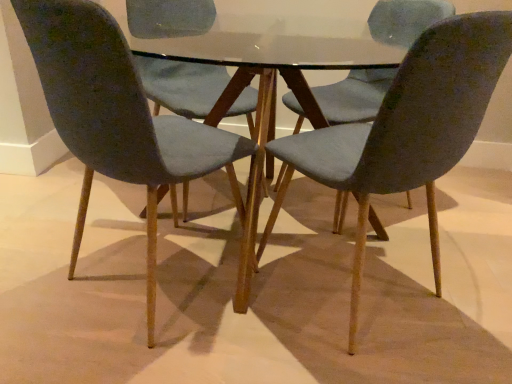
The image size is (512, 384). What do you see at coordinates (197, 88) in the screenshot?
I see `velvet blue chair at center, which appears as the second chair when viewed from the left` at bounding box center [197, 88].

In order to face matte blue chair at center, placed as the third chair when sorted from left to right, should I rotate leftwards or rightwards?

Turn right approximately 15.133 degrees to face it.

The width and height of the screenshot is (512, 384). Find the location of `velvet blue chair at center, the 2th chair from the right`. velvet blue chair at center, the 2th chair from the right is located at coordinates coord(197,88).

Which of these two, glass table at center or matte blue chair at center, which is the first chair from right to left, is bigger?

glass table at center.

Where is `chair that is the 2nd one when counting downward from the glass table at center (from the image's perspective)`? Image resolution: width=512 pixels, height=384 pixels. chair that is the 2nd one when counting downward from the glass table at center (from the image's perspective) is located at coordinates (406, 130).

From the image's perspective, between glass table at center and matte blue chair at center, which is the first chair from right to left, who is located below?

matte blue chair at center, which is the first chair from right to left, from the image's perspective.

Does glass table at center lie behind matte blue chair at center, placed as the third chair when sorted from left to right?

Yes, it is behind matte blue chair at center, placed as the third chair when sorted from left to right.

Would you say matte blue chair at center, placed as the third chair when sorted from left to right, is to the left or to the right of glass table at center in the picture?

matte blue chair at center, placed as the third chair when sorted from left to right, is to the right of glass table at center.

Is matte blue chair at center, placed as the third chair when sorted from left to right, located outside glass table at center?

No, matte blue chair at center, placed as the third chair when sorted from left to right, is not outside of glass table at center.

From the image's perspective, is matte blue chair at center, placed as the third chair when sorted from left to right, beneath glass table at center?

Correct, matte blue chair at center, placed as the third chair when sorted from left to right, appears lower than glass table at center in the image.

Consider the image. Between matte gray chair at left, which appears as the 3th chair when viewed from the right, and glass table at center, which one has less height?

Standing shorter between the two is glass table at center.

Which object is further away from the camera taking this photo, matte gray chair at left, the first chair viewed from the left, or glass table at center?

glass table at center is further from the camera.

From the image's perspective, is matte gray chair at left, which appears as the 3th chair when viewed from the right, below glass table at center?

Indeed, from the image's perspective, matte gray chair at left, which appears as the 3th chair when viewed from the right, is shown beneath glass table at center.

Could you measure the distance between matte gray chair at left, which appears as the 3th chair when viewed from the right, and glass table at center?

matte gray chair at left, which appears as the 3th chair when viewed from the right, and glass table at center are 19.06 inches apart.

Is matte blue chair at center, placed as the third chair when sorted from left to right, not close to velvet blue chair at center, which appears as the second chair when viewed from the left?

No.

Considering the points (413, 151) and (186, 80), which point is behind, point (413, 151) or point (186, 80)?

Point (186, 80)

Is matte blue chair at center, which is the first chair from right to left, at the right side of velvet blue chair at center, which appears as the second chair when viewed from the left?

Correct, you'll find matte blue chair at center, which is the first chair from right to left, to the right of velvet blue chair at center, which appears as the second chair when viewed from the left.

Between matte blue chair at center, which is the first chair from right to left, and velvet blue chair at center, which appears as the second chair when viewed from the left, which one has less height?

Standing shorter between the two is velvet blue chair at center, which appears as the second chair when viewed from the left.

From a real-world perspective, between glass table at center and velvet blue chair at center, the 2th chair from the right, who is vertically higher?

velvet blue chair at center, the 2th chair from the right, is physically above.

How much distance is there between glass table at center and velvet blue chair at center, which appears as the second chair when viewed from the left?

The distance of glass table at center from velvet blue chair at center, which appears as the second chair when viewed from the left, is 8.11 inches.

In the scene shown: Between glass table at center and velvet blue chair at center, the 2th chair from the right, which one has smaller width?

velvet blue chair at center, the 2th chair from the right.

In the scene shown: Are velvet blue chair at center, which appears as the second chair when viewed from the left, and matte gray chair at left, the first chair viewed from the left, making contact?

No, velvet blue chair at center, which appears as the second chair when viewed from the left, is not in contact with matte gray chair at left, the first chair viewed from the left.

Considering the sizes of velvet blue chair at center, the 2th chair from the right, and matte gray chair at left, the first chair viewed from the left, in the image, is velvet blue chair at center, the 2th chair from the right, wider or thinner than matte gray chair at left, the first chair viewed from the left,?

Clearly, velvet blue chair at center, the 2th chair from the right, has less width compared to matte gray chair at left, the first chair viewed from the left.

Where is `round table that is above the matte gray chair at left, the first chair viewed from the left (from the image's perspective)`? The width and height of the screenshot is (512, 384). round table that is above the matte gray chair at left, the first chair viewed from the left (from the image's perspective) is located at coordinates (289, 52).

Is glass table at center oriented away from matte gray chair at left, which appears as the 3th chair when viewed from the right?

No, glass table at center is not facing the opposite direction of matte gray chair at left, which appears as the 3th chair when viewed from the right.

Does glass table at center appear on the left side of matte gray chair at left, which appears as the 3th chair when viewed from the right?

No.

From a real-world perspective, which chair is the 2nd one above the glass table at center? Please provide its 2D coordinates.

[(406, 130)]

In order to click on the 2nd chair below when counting from the glass table at center (from the image's perspective) in this screenshot , I will do `click(406, 130)`.

Which object lies nearer to the anchor point matte blue chair at center, which is the first chair from right to left, velvet blue chair at center, which appears as the second chair when viewed from the left, or glass table at center?

The object closer to matte blue chair at center, which is the first chair from right to left, is glass table at center.

Based on their spatial positions, is glass table at center or matte blue chair at center, which is the first chair from right to left, further from matte gray chair at left, the first chair viewed from the left?

glass table at center is positioned further to the anchor matte gray chair at left, the first chair viewed from the left.

Based on the photo, from the image, which object appears to be farther from matte gray chair at left, the first chair viewed from the left, velvet blue chair at center, the 2th chair from the right, or matte blue chair at center, which is the first chair from right to left?

Based on the image, matte blue chair at center, which is the first chair from right to left, appears to be further to matte gray chair at left, the first chair viewed from the left.

From the image, which object appears to be nearer to matte blue chair at center, which is the first chair from right to left, glass table at center or velvet blue chair at center, the 2th chair from the right?

glass table at center.

Looking at the image, which one is located further to velvet blue chair at center, which appears as the second chair when viewed from the left, glass table at center or matte gray chair at left, the first chair viewed from the left?

Among the two, matte gray chair at left, the first chair viewed from the left, is located further to velvet blue chair at center, which appears as the second chair when viewed from the left.

When comparing their distances from matte gray chair at left, the first chair viewed from the left, does glass table at center or velvet blue chair at center, the 2th chair from the right, seem further?

Based on the image, glass table at center appears to be further to matte gray chair at left, the first chair viewed from the left.

Based on their spatial positions, is matte blue chair at center, which is the first chair from right to left, or matte gray chair at left, which appears as the 3th chair when viewed from the right, further from velvet blue chair at center, which appears as the second chair when viewed from the left?

Among the two, matte blue chair at center, which is the first chair from right to left, is located further to velvet blue chair at center, which appears as the second chair when viewed from the left.

Considering their positions, is matte blue chair at center, which is the first chair from right to left, positioned further to matte gray chair at left, the first chair viewed from the left, than velvet blue chair at center, which appears as the second chair when viewed from the left?

matte blue chair at center, which is the first chair from right to left, is positioned further to the anchor matte gray chair at left, the first chair viewed from the left.

Identify the location of chair between matte gray chair at left, which appears as the 3th chair when viewed from the right, and velvet blue chair at center, which appears as the second chair when viewed from the left, in the front-back direction. (406, 130).

Find the location of `round table between matte gray chair at left, which appears as the 3th chair when viewed from the right, and matte blue chair at center, placed as the third chair when sorted from left to right, in the horizontal direction`. round table between matte gray chair at left, which appears as the 3th chair when viewed from the right, and matte blue chair at center, placed as the third chair when sorted from left to right, in the horizontal direction is located at coordinates (289, 52).

Where is `round table between matte gray chair at left, which appears as the 3th chair when viewed from the right, and velvet blue chair at center, which appears as the second chair when viewed from the left, from front to back`? This screenshot has width=512, height=384. round table between matte gray chair at left, which appears as the 3th chair when viewed from the right, and velvet blue chair at center, which appears as the second chair when viewed from the left, from front to back is located at coordinates (289, 52).

The height and width of the screenshot is (384, 512). What are the coordinates of `round table between matte blue chair at center, placed as the third chair when sorted from left to right, and velvet blue chair at center, the 2th chair from the right, along the z-axis` in the screenshot? It's located at (289, 52).